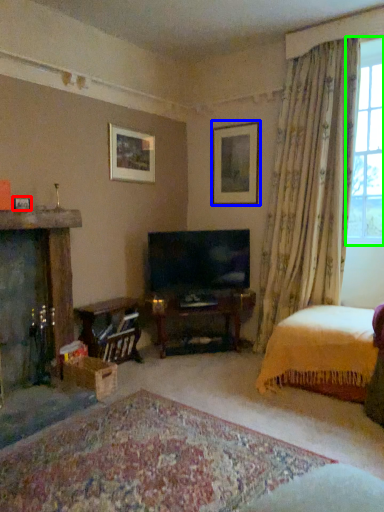
Question: Which is farther away from picture frame (highlighted by a red box)? picture frame (highlighted by a blue box) or window (highlighted by a green box)?

Choices:
 (A) picture frame
 (B) window

Answer: (B)